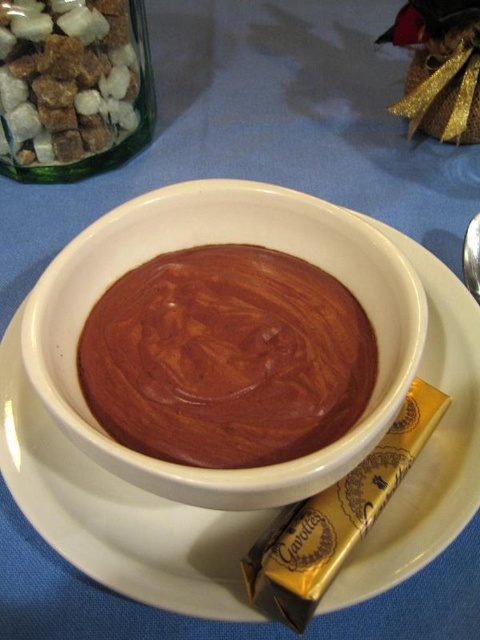
Question: Which point is closer to the camera?

Choices:
 (A) (69, 484)
 (B) (251, 572)
 (C) (2, 54)

Answer: (B)

Question: Is the position of smooth chocolate at center less distant than that of brown sugar cubes at upper left?

Choices:
 (A) no
 (B) yes

Answer: (B)

Question: Can you confirm if brown sugar cubes at upper left is thinner than gold foil chocolate bar at center?

Choices:
 (A) no
 (B) yes

Answer: (A)

Question: Among these objects, which one is nearest to the camera?

Choices:
 (A) gold foil chocolate bar at center
 (B) white ceramic plate at center
 (C) silver metallic spoon at upper right
 (D) brown sugar cubes at upper left

Answer: (A)

Question: Based on their relative distances, which object is farther from the silver metallic spoon at upper right?

Choices:
 (A) white ceramic plate at center
 (B) brown sugar cubes at upper left
 (C) smooth chocolate at center

Answer: (B)

Question: Is brown sugar cubes at upper left thinner than gold foil chocolate bar at center?

Choices:
 (A) yes
 (B) no

Answer: (B)